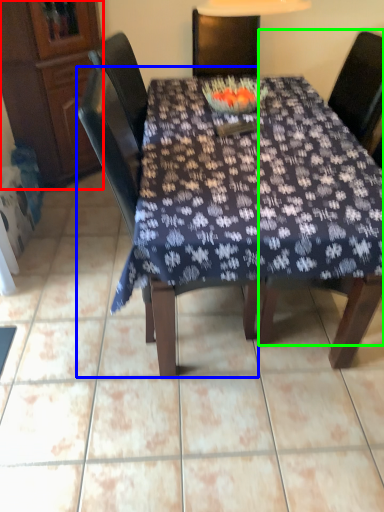
Question: Considering the real-world distances, which object is closest to cabinetry (highlighted by a red box)? chair (highlighted by a blue box) or chair (highlighted by a green box).

Choices:
 (A) chair
 (B) chair

Answer: (A)